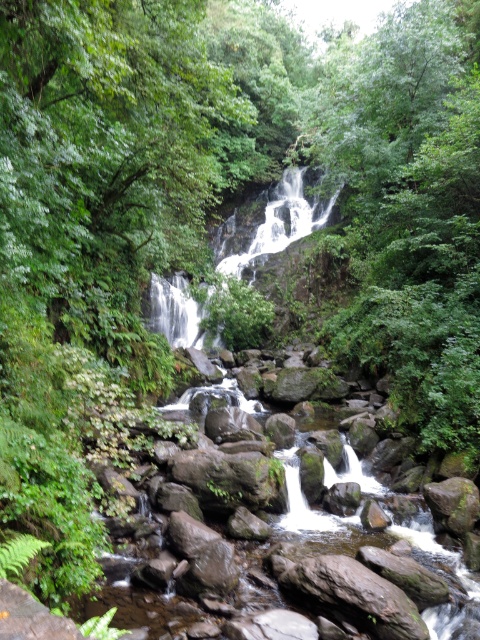
Is green mossy rock at center bigger than white smooth waterfall at center?

Indeed, green mossy rock at center has a larger size compared to white smooth waterfall at center.

Can you confirm if green mossy rock at center is positioned below white smooth waterfall at center?

Correct, green mossy rock at center is located below white smooth waterfall at center.

Is point (264, 196) in front of point (286, 202)?

No, it is not.

You are a GUI agent. You are given a task and a screenshot of the screen. Output one action in this format:
    pyautogui.click(x=<x>, y=<y>)
    Task: Click on the green mossy rock at center
    
    Given the screenshot: What is the action you would take?
    pyautogui.click(x=274, y=221)